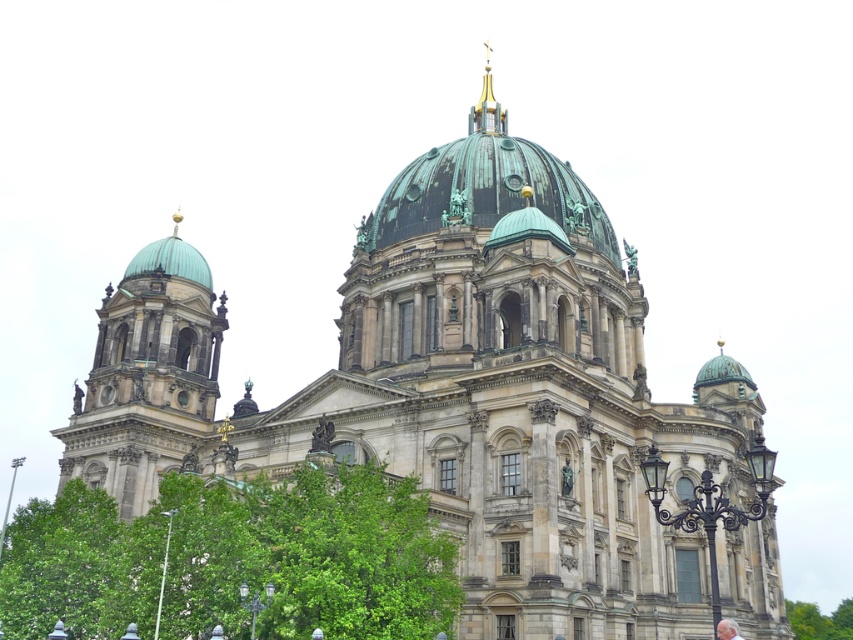
You are a maintenance worker needing to move a ladder from the green leafy tree at center to the green copper dome at left. The ladder is 10 meters long. Can you safely carry the ladder horizontally between these two points without it touching the ground?

The distance between the green leafy tree at center and the green copper dome at left is 11.57 meters. Since the ladder is only 10 meters long, it will not reach across the gap. Therefore, you cannot safely carry the ladder horizontally between these two points without it touching the ground.

You are standing in front of the cathedral and want to take a photo of the green copper dome at left and the green leafy tree at center. Which one will appear taller in the photo?

The green copper dome at left will appear taller in the photo because it is taller than the green leafy tree at center.